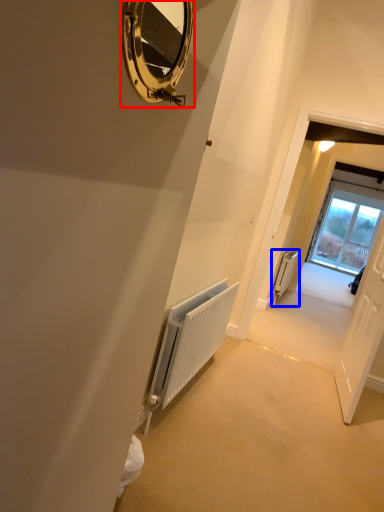
Question: Which object appears closest to the camera in this image, mirror (highlighted by a red box) or radiator (highlighted by a blue box)?

Choices:
 (A) mirror
 (B) radiator

Answer: (A)